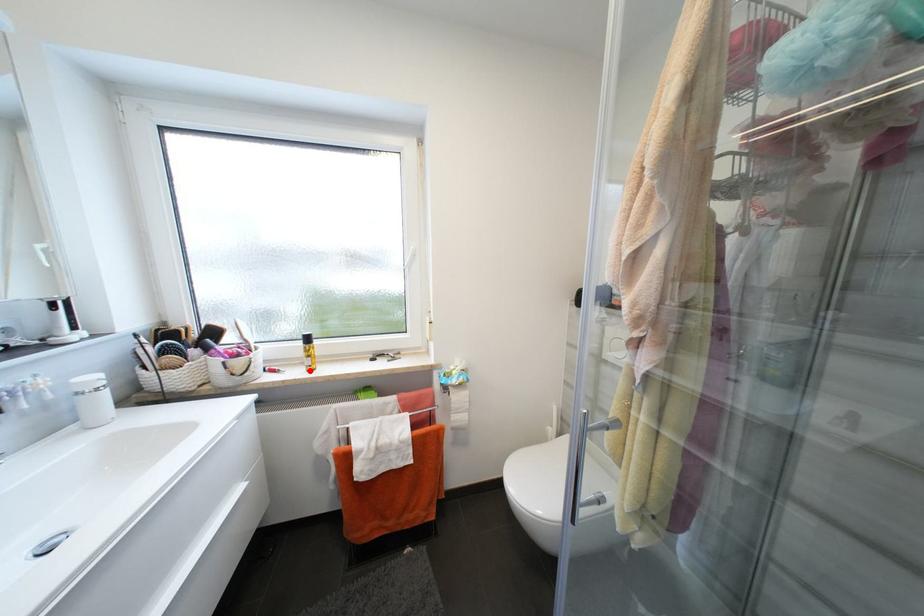
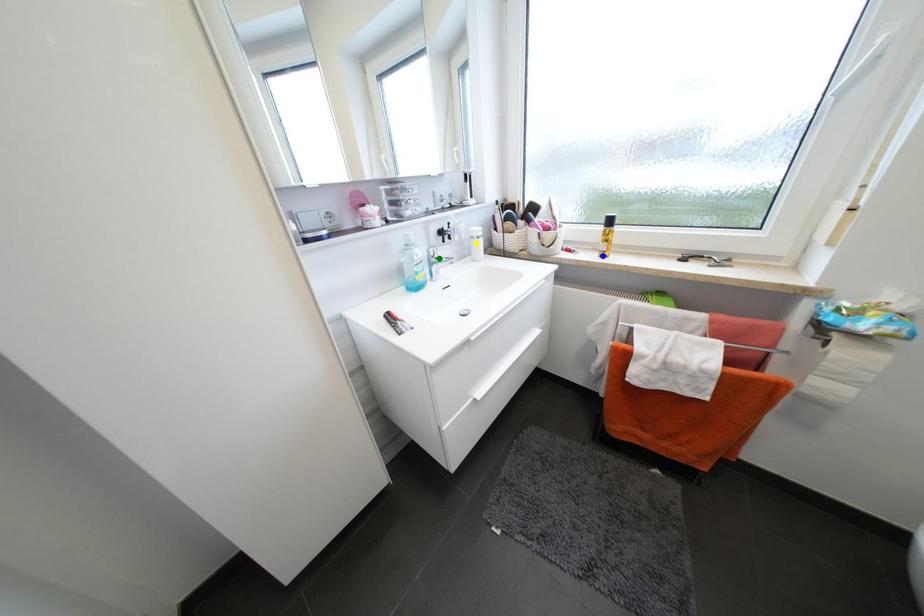
Question: I am providing you with two images of the same scene from different viewpoints. A red point is marked on the first image. You are given multiple points on the second image. In image 2, which mark is for the same physical point as the one in image 1?

Choices:
 (A) green point
 (B) blue point
 (C) yellow point

Answer: (B)